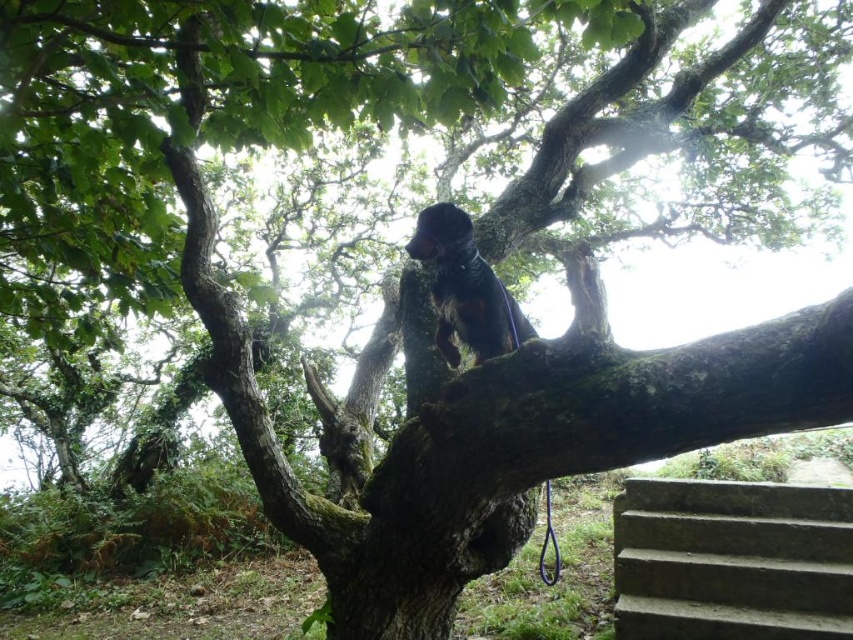
You are standing at the base of the gray concrete stairs at lower right and want to reach the dog on the tree branch. How many steps do you need to climb to get to the dog?

The gray concrete stairs at lower right is 3.04 meters away from viewer. Since the stairs are at the base, you would need to climb all the steps to reach the dog on the tree branch, but the exact number of steps isn answer provided in the description.

You are a person standing at the bottom of the gray concrete stairs at lower right, looking up towards the shiny brown fur at upper center. Which object is wider from your perspective?

The gray concrete stairs at lower right are wider than the shiny brown fur at upper center from your perspective.